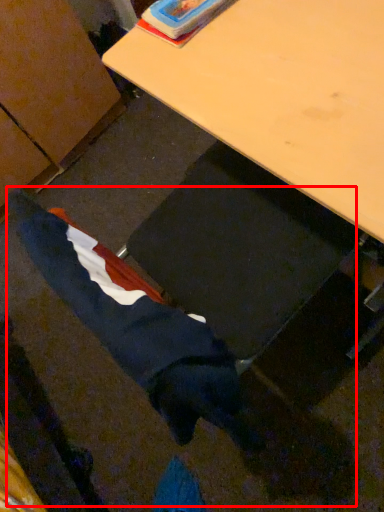
Question: Where is woman (annotated by the red box) located in relation to desk in the image?

Choices:
 (A) right
 (B) left

Answer: (B)